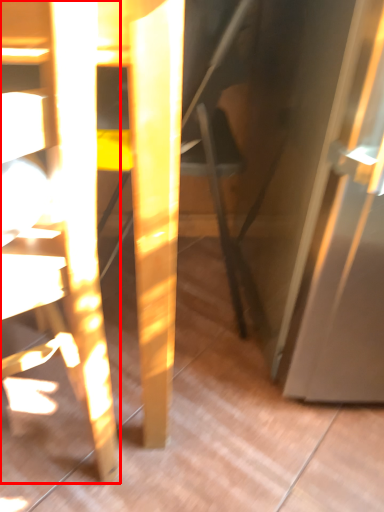
Question: From the image's perspective, where is chair (annotated by the red box) located in relation to swivel chair in the image?

Choices:
 (A) above
 (B) below

Answer: (B)